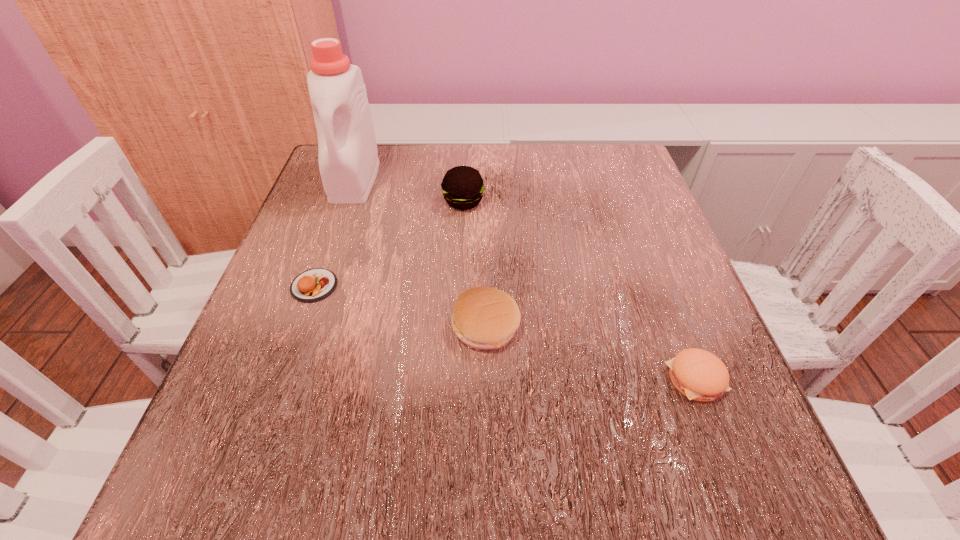
Locate an element on the screen. Image resolution: width=960 pixels, height=540 pixels. vacant space that satisfies the following two spatial constraints: 1. on the front side of the leftmost patty (food); 2. on the left side of the third shortest patty (food) is located at coordinates (300, 326).

This screenshot has width=960, height=540. In order to click on vacant position in the image that satisfies the following two spatial constraints: 1. on the handle side of the third shortest patty (food); 2. on the left side of the detergent in this screenshot , I will do `click(304, 326)`.